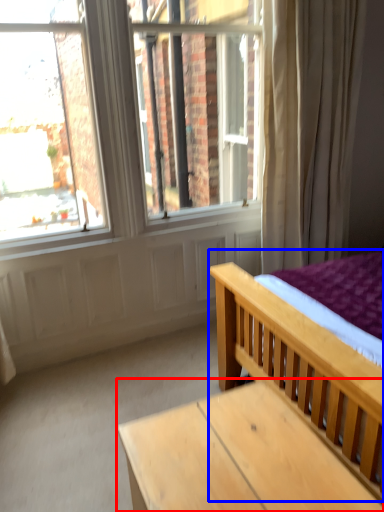
Question: Which object is further to the camera taking this photo, table (highlighted by a red box) or bed (highlighted by a blue box)?

Choices:
 (A) table
 (B) bed

Answer: (A)